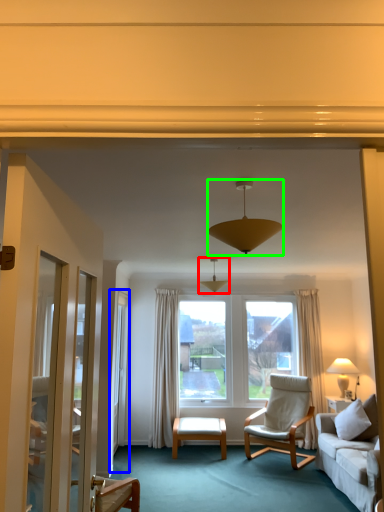
Question: Which is nearer to the lamp (highlighted by a red box)? screen door (highlighted by a blue box) or lamp (highlighted by a green box).

Choices:
 (A) screen door
 (B) lamp

Answer: (A)